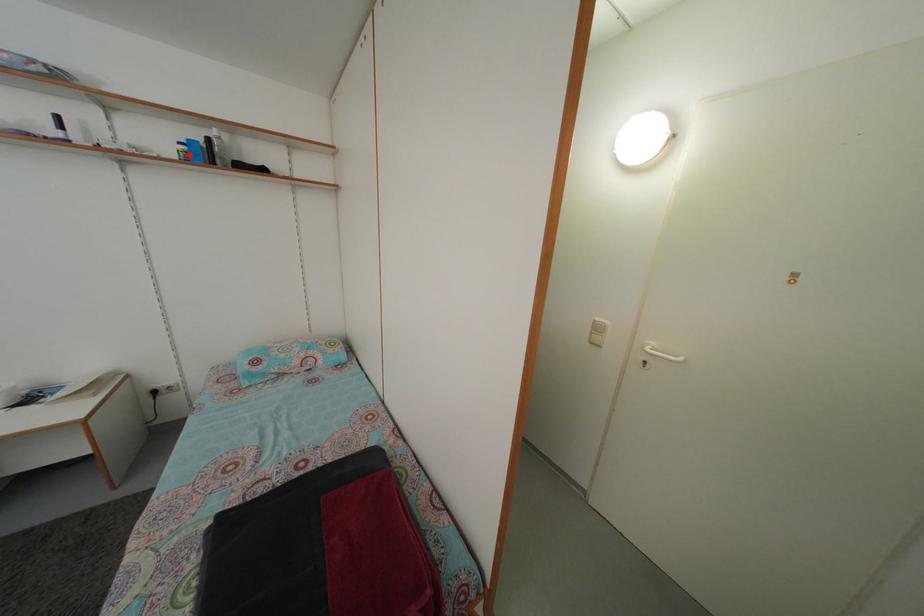
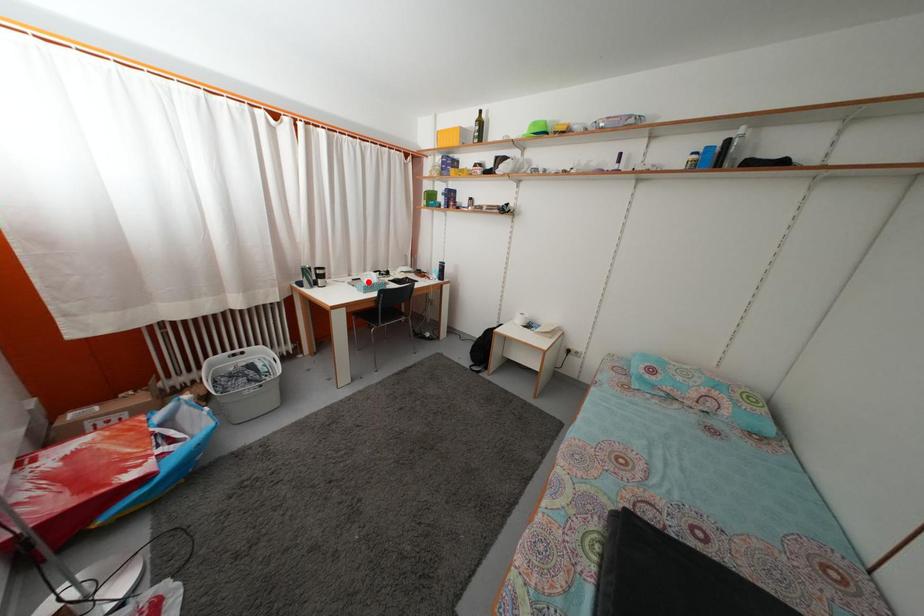
I am providing you with two images of the same scene from different viewpoints. A red point is marked on the first image and another point is marked on the second image. Do the highlighted points in image1 and image2 indicate the same real-world spot?

No